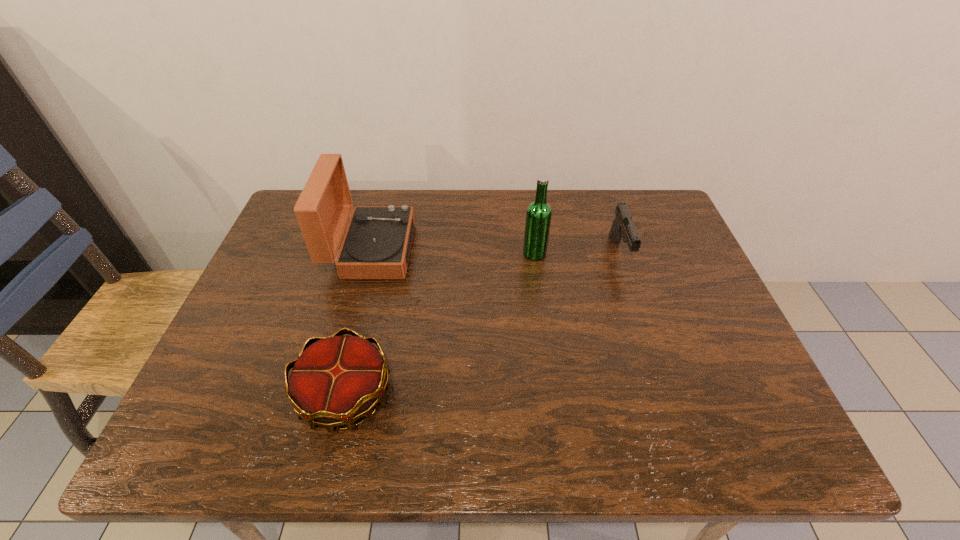
The height and width of the screenshot is (540, 960). Find the location of `vacant region that satisfies the following two spatial constraints: 1. on the face of the phonograph record; 2. on the left side of the third object from left to right`. vacant region that satisfies the following two spatial constraints: 1. on the face of the phonograph record; 2. on the left side of the third object from left to right is located at coordinates (371, 253).

Image resolution: width=960 pixels, height=540 pixels. I want to click on vacant position in the image that satisfies the following two spatial constraints: 1. on the face of the phonograph record; 2. on the right side of the crown, so click(x=333, y=395).

This screenshot has height=540, width=960. I want to click on vacant area in the image that satisfies the following two spatial constraints: 1. on the face of the phonograph record; 2. on the back side of the nearest object, so (333, 395).

At what (x,y) coordinates should I click in order to perform the action: click on vacant space that satisfies the following two spatial constraints: 1. on the face of the phonograph record; 2. on the right side of the beer bottle. Please return your answer as a coordinate pair (x, y). The height and width of the screenshot is (540, 960). Looking at the image, I should click on (371, 253).

I want to click on vacant space that satisfies the following two spatial constraints: 1. on the face of the phonograph record; 2. on the left side of the nearest object, so click(333, 395).